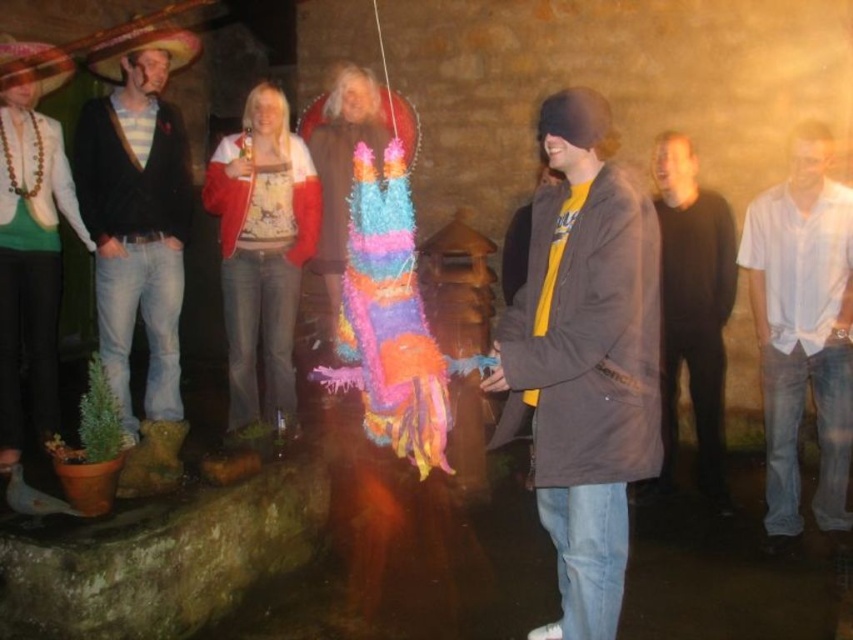
You are standing at the point labeled as point (x=54, y=67) and want to walk towards the point labeled as point (x=155, y=339). Which direction should you head?

You should head forward because point (x=155, y=339) is in front of point (x=54, y=67).

You are at a party and want to find the person wearing the striped shirt at left. Where should you look relative to the matte brown sombrero at upper left?

The striped shirt at left is located below the matte brown sombrero at upper left, so you should look downward from the matte brown sombrero at upper left to find the striped shirt at left.

You are standing at the point labeled as point (186,33) and want to move towards the point labeled as point (97,124). Based on the scene description, is the path between these two points clear of obstacles?

Yes, the path between point (186,33) and point (97,124) is clear because point (97,124) is in front of point (186,33), indicating no obstruction between them.